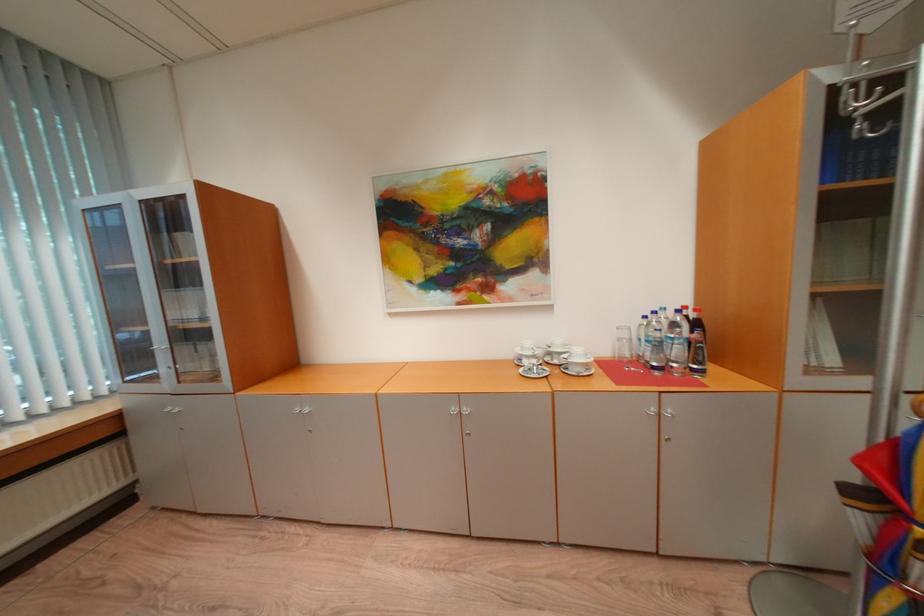
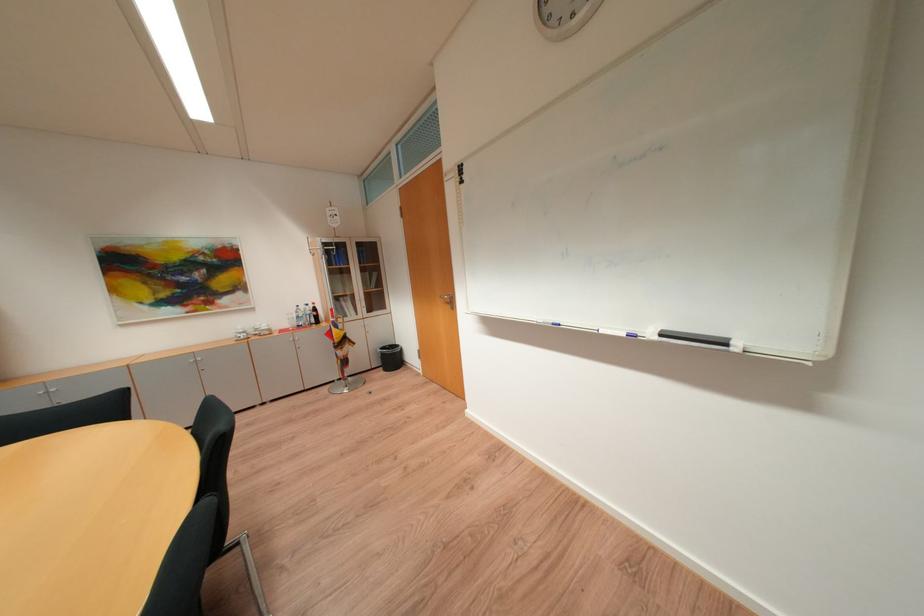
Find the pixel in the second image that matches (666,345) in the first image.

(307, 318)